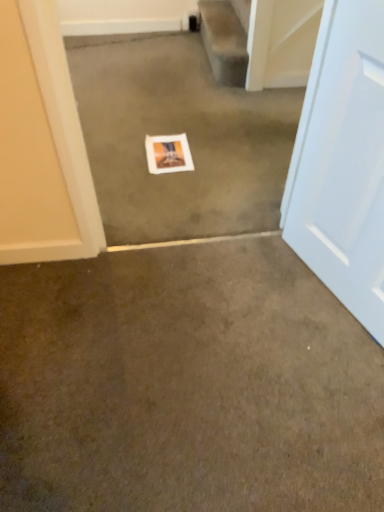
Question: Does smooth beige carpet at upper center have a smaller size compared to brown carpet at center, which is counted as the first concrete, starting from the bottom?

Choices:
 (A) no
 (B) yes

Answer: (B)

Question: From the image's perspective, does smooth beige carpet at upper center appear lower than brown carpet at center, the second concrete viewed from the top?

Choices:
 (A) yes
 (B) no

Answer: (B)

Question: Considering the relative sizes of smooth beige carpet at upper center and brown carpet at center, which is counted as the first concrete, starting from the bottom, in the image provided, is smooth beige carpet at upper center shorter than brown carpet at center, which is counted as the first concrete, starting from the bottom,?

Choices:
 (A) yes
 (B) no

Answer: (B)

Question: From a real-world perspective, is smooth beige carpet at upper center on top of brown carpet at center, which is counted as the first concrete, starting from the bottom?

Choices:
 (A) yes
 (B) no

Answer: (A)

Question: From the image's perspective, is smooth beige carpet at upper center above brown carpet at center, which is counted as the first concrete, starting from the bottom?

Choices:
 (A) no
 (B) yes

Answer: (B)

Question: Is smooth beige carpet at upper center not inside brown carpet at center, which is counted as the first concrete, starting from the bottom?

Choices:
 (A) no
 (B) yes

Answer: (B)

Question: Is white glossy door at right closer to camera compared to white matte picture frame at center?

Choices:
 (A) yes
 (B) no

Answer: (A)

Question: Can you confirm if white glossy door at right is bigger than white matte picture frame at center?

Choices:
 (A) no
 (B) yes

Answer: (B)

Question: Is white glossy door at right aimed at white matte picture frame at center?

Choices:
 (A) yes
 (B) no

Answer: (B)

Question: From a real-world perspective, is white glossy door at right physically above white matte picture frame at center?

Choices:
 (A) yes
 (B) no

Answer: (A)

Question: Does white glossy door at right have a greater height compared to white matte picture frame at center?

Choices:
 (A) no
 (B) yes

Answer: (B)

Question: Can you confirm if white glossy door at right is wider than white matte picture frame at center?

Choices:
 (A) no
 (B) yes

Answer: (A)

Question: Are smooth beige carpet at upper center and white glossy door at right far apart?

Choices:
 (A) yes
 (B) no

Answer: (A)